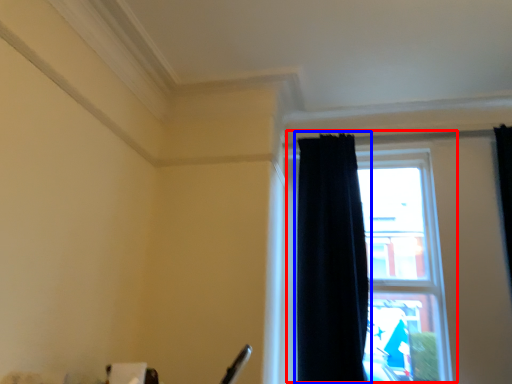
Question: Among these objects, which one is nearest to the camera, window (highlighted by a red box) or curtain (highlighted by a blue box)?

Choices:
 (A) window
 (B) curtain

Answer: (B)